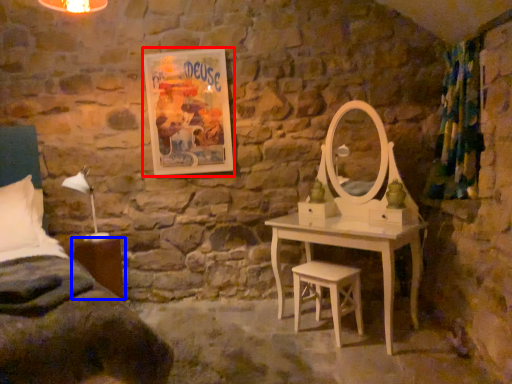
Question: Which object is further to the camera taking this photo, picture frame (highlighted by a red box) or nightstand (highlighted by a blue box)?

Choices:
 (A) picture frame
 (B) nightstand

Answer: (A)